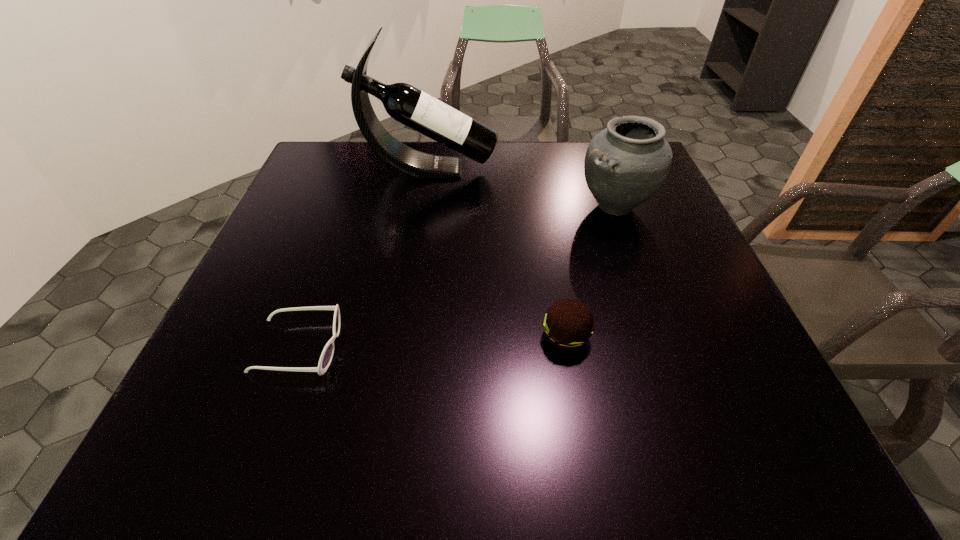
Where is `free point located 0.290m with the lenses of the shortest object facing outward`? free point located 0.290m with the lenses of the shortest object facing outward is located at coordinates (496, 347).

Where is `wine bottle located at the far edge`? The height and width of the screenshot is (540, 960). wine bottle located at the far edge is located at coordinates (406, 104).

Locate an element on the screen. The image size is (960, 540). urn that is at the far edge is located at coordinates (626, 164).

This screenshot has width=960, height=540. I want to click on wine bottle at the left edge, so click(x=406, y=104).

Where is `sunglasses situated at the left edge`? sunglasses situated at the left edge is located at coordinates (326, 357).

The image size is (960, 540). What are the coordinates of `object positioned at the right edge` in the screenshot? It's located at (626, 164).

This screenshot has width=960, height=540. I want to click on object present at the far left corner, so click(x=406, y=104).

The image size is (960, 540). Find the location of `object that is at the far right corner`. object that is at the far right corner is located at coordinates (626, 164).

In the image, there is a desktop. Identify the location of vacant space at the far edge. Image resolution: width=960 pixels, height=540 pixels. (389, 185).

This screenshot has height=540, width=960. Find the location of `free space at the near edge`. free space at the near edge is located at coordinates (639, 467).